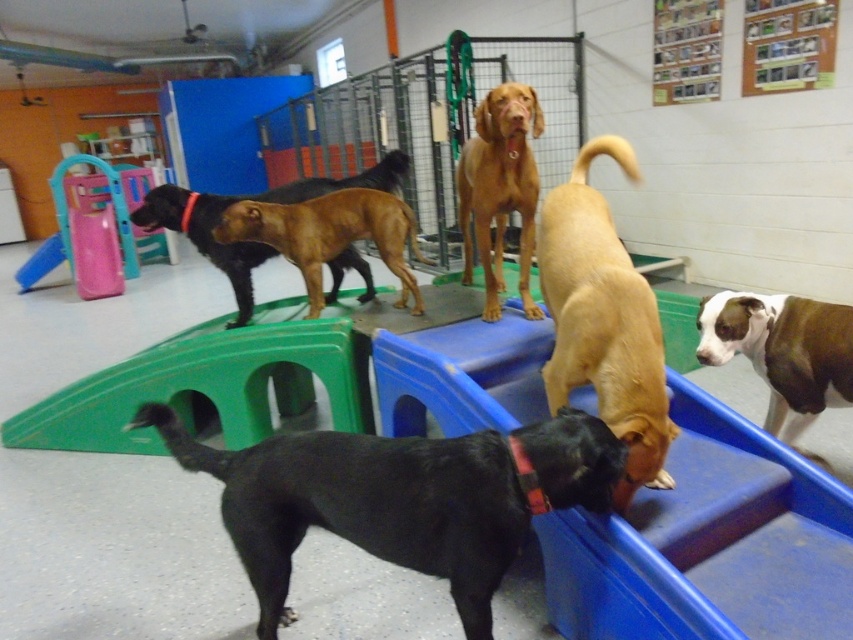
How much distance is there between brown wire mesh cage at center and brown/white fur at right?

brown wire mesh cage at center is 4.16 meters from brown/white fur at right.

Does brown wire mesh cage at center appear under brown/white fur at right?

No, brown wire mesh cage at center is not below brown/white fur at right.

Between point (570, 77) and point (820, 321), which one is positioned in front?

Positioned in front is point (820, 321).

The height and width of the screenshot is (640, 853). In order to click on brown wire mesh cage at center in this screenshot , I will do `click(427, 120)`.

Is black smooth dog at lower left further to the viewer compared to brown smooth dog at center?

That is False.

Does black smooth dog at lower left have a lesser width compared to brown smooth dog at center?

No, black smooth dog at lower left is not thinner than brown smooth dog at center.

From the picture: Who is more forward, [293,504] or [321,266]?

Positioned in front is point [293,504].

Find the location of `black smooth dog at lower left`. black smooth dog at lower left is located at coordinates (399, 499).

Is black smooth dog at lower left further to camera compared to brown matte dog at center?

No, black smooth dog at lower left is closer to the viewer.

Who is positioned more to the left, black smooth dog at lower left or brown matte dog at center?

black smooth dog at lower left is more to the left.

Which is behind, point (352, 452) or point (491, 248)?

The point (491, 248) is behind.

Find the location of a particular element. The image size is (853, 640). black smooth dog at lower left is located at coordinates (399, 499).